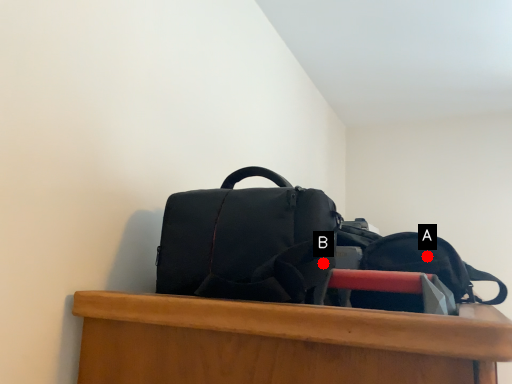
Question: Two points are circled on the image, labeled by A and B beside each circle. Which point is closer to the camera?

Choices:
 (A) A is closer
 (B) B is closer

Answer: (B)